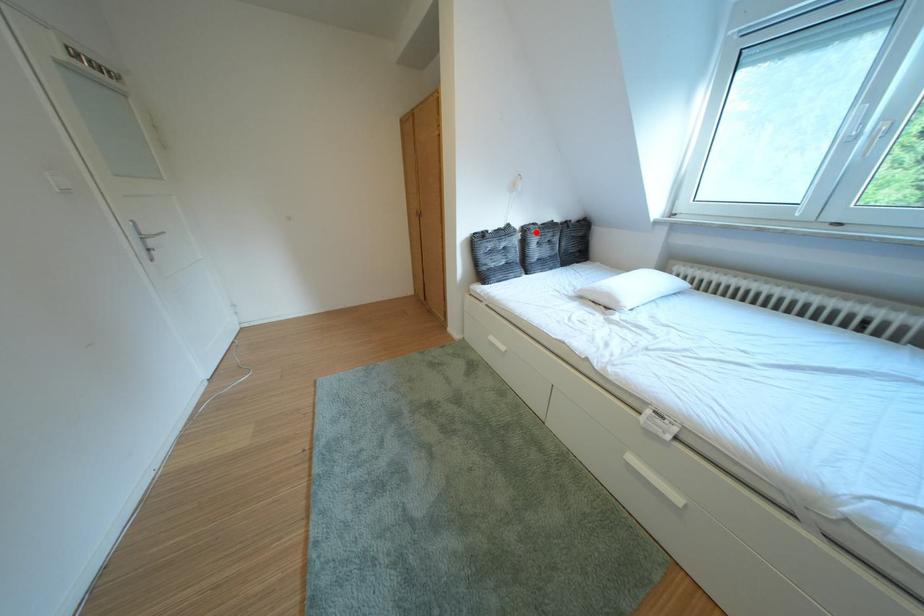
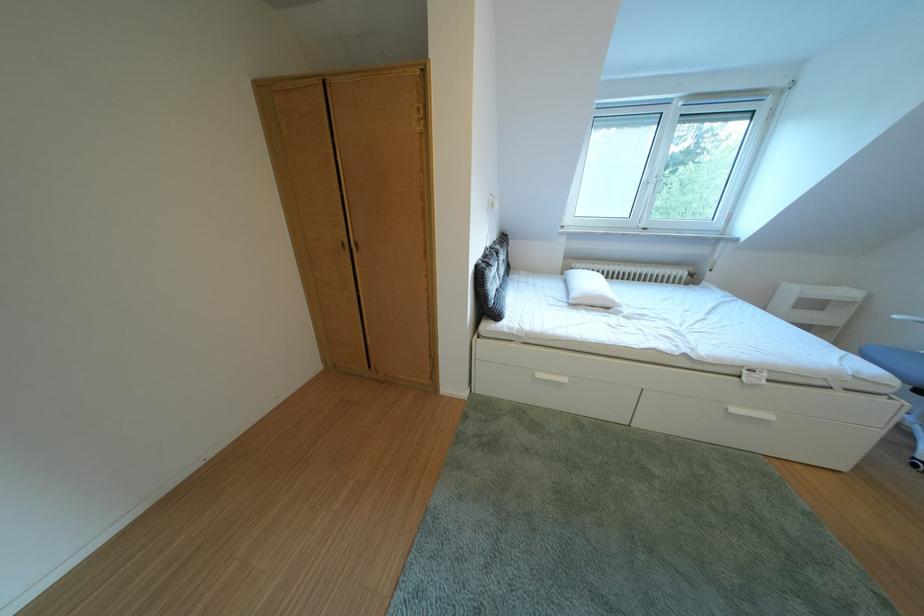
Question: I am providing you with two images of the same scene from different viewpoints. In image1, a red point is highlighted. Considering the same 3D point in image2, which of the following is correct?

Choices:
 (A) It is closer
 (B) It is farther

Answer: (B)